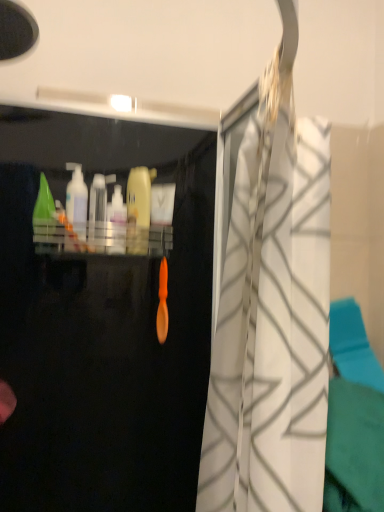
What is the approximate height of translucent plastic bottle at left, positioned as the 3th cleaning product in right-to-left order?

The height of translucent plastic bottle at left, positioned as the 3th cleaning product in right-to-left order, is 8.21 inches.

The width and height of the screenshot is (384, 512). Describe the element at coordinates (97, 213) in the screenshot. I see `transparent plastic bottle at center` at that location.

Where is `white textured curtain at center`? This screenshot has height=512, width=384. white textured curtain at center is located at coordinates (272, 321).

Image resolution: width=384 pixels, height=512 pixels. What do you see at coordinates (118, 218) in the screenshot? I see `translucent plastic bottle at center, the second cleaning product viewed from the right` at bounding box center [118, 218].

You are a GUI agent. You are given a task and a screenshot of the screen. Output one action in this format:
    pyautogui.click(x=<x>, y=<y>)
    Task: Click on the translucent plastic bottle at left, which ranks as the 2th cleaning product in left-to-right order
    
    Given the screenshot: What is the action you would take?
    pyautogui.click(x=77, y=206)

Is yellow matte bottle at center, which is the first cleaning product in right-to-left order, not near translucent plastic bottle at left, which ranks as the 2th cleaning product in left-to-right order?

Actually, yellow matte bottle at center, which is the first cleaning product in right-to-left order, and translucent plastic bottle at left, which ranks as the 2th cleaning product in left-to-right order, are a little close together.

Can you confirm if yellow matte bottle at center, which is the first cleaning product in right-to-left order, is shorter than translucent plastic bottle at left, which ranks as the 2th cleaning product in left-to-right order?

In fact, yellow matte bottle at center, which is the first cleaning product in right-to-left order, may be taller than translucent plastic bottle at left, which ranks as the 2th cleaning product in left-to-right order.

From the yellow matte bottle at center, which is the first cleaning product in right-to-left order, count the 2nd cleaning product to the left and point to it. Please provide its 2D coordinates.

[(77, 206)]

Considering the points (149, 219) and (78, 212), which point is in front, point (149, 219) or point (78, 212)?

The point (78, 212) is more forward.

Is translucent plastic bottle at center, the second cleaning product viewed from the right, at the right side of transparent plastic bottle at center?

Yes.

Which object is closer to the camera, translucent plastic bottle at center, acting as the third cleaning product starting from the left, or transparent plastic bottle at center?

transparent plastic bottle at center.

Is translucent plastic bottle at center, acting as the third cleaning product starting from the left, situated inside transparent plastic bottle at center or outside?

translucent plastic bottle at center, acting as the third cleaning product starting from the left, cannot be found inside transparent plastic bottle at center.

Is translucent plastic bottle at center, acting as the third cleaning product starting from the left, wider than transparent plastic bottle at center?

No, translucent plastic bottle at center, acting as the third cleaning product starting from the left, is not wider than transparent plastic bottle at center.

From the image's perspective, is yellow matte bottle at center, arranged as the 4th cleaning product when viewed from the left, below white textured curtain at center?

No.

Considering the sizes of yellow matte bottle at center, which is the first cleaning product in right-to-left order, and white textured curtain at center in the image, is yellow matte bottle at center, which is the first cleaning product in right-to-left order, wider or thinner than white textured curtain at center?

In the image, yellow matte bottle at center, which is the first cleaning product in right-to-left order, appears to be more narrow than white textured curtain at center.

Considering the positions of objects yellow matte bottle at center, which is the first cleaning product in right-to-left order, and white textured curtain at center in the image provided, who is more to the right, yellow matte bottle at center, which is the first cleaning product in right-to-left order, or white textured curtain at center?

From the viewer's perspective, white textured curtain at center appears more on the right side.

Can you tell me how much yellow matte bottle at center, which is the first cleaning product in right-to-left order, and white textured curtain at center differ in facing direction?

75.4 degrees separate the facing orientations of yellow matte bottle at center, which is the first cleaning product in right-to-left order, and white textured curtain at center.

Is translucent plastic bottle at center, the second cleaning product viewed from the right, to the right of white textured curtain at center from the viewer's perspective?

No.

Which object is wider, translucent plastic bottle at center, acting as the third cleaning product starting from the left, or white textured curtain at center?

With larger width is white textured curtain at center.

Are translucent plastic bottle at center, the second cleaning product viewed from the right, and white textured curtain at center located far from each other?

No, translucent plastic bottle at center, the second cleaning product viewed from the right, is not far from white textured curtain at center.

From their relative heights in the image, would you say translucent plastic bottle at center, acting as the third cleaning product starting from the left, is taller or shorter than white textured curtain at center?

translucent plastic bottle at center, acting as the third cleaning product starting from the left, is shorter than white textured curtain at center.

Is translucent plastic bottle at center, the second cleaning product viewed from the right, facing away from yellow matte bottle at center, which is the first cleaning product in right-to-left order?

No, translucent plastic bottle at center, the second cleaning product viewed from the right, is not facing away from yellow matte bottle at center, which is the first cleaning product in right-to-left order.

Can you confirm if translucent plastic bottle at center, acting as the third cleaning product starting from the left, is positioned to the right of yellow matte bottle at center, which is the first cleaning product in right-to-left order?

No.

Are translucent plastic bottle at center, the second cleaning product viewed from the right, and yellow matte bottle at center, arranged as the 4th cleaning product when viewed from the left, located far from each other?

That's not correct — translucent plastic bottle at center, the second cleaning product viewed from the right, is a little close to yellow matte bottle at center, arranged as the 4th cleaning product when viewed from the left.

How many degrees apart are the facing directions of translucent plastic bottle at center, the second cleaning product viewed from the right, and yellow matte bottle at center, which is the first cleaning product in right-to-left order?

They differ by 0.00444 degrees in their facing directions.

Is green plastic cone at upper left, which is counted as the fourth cleaning product, starting from the right, with white textured curtain at center?

No, green plastic cone at upper left, which is counted as the fourth cleaning product, starting from the right, is not in contact with white textured curtain at center.

Is point (52, 220) positioned behind point (236, 441)?

Yes, it is.

Where is `curtain on the right of green plastic cone at upper left, which is counted as the fourth cleaning product, starting from the right`? The width and height of the screenshot is (384, 512). curtain on the right of green plastic cone at upper left, which is counted as the fourth cleaning product, starting from the right is located at coordinates (272, 321).

Is white textured curtain at center facing towards translucent plastic bottle at left, which ranks as the 2th cleaning product in left-to-right order?

No, white textured curtain at center is not oriented towards translucent plastic bottle at left, which ranks as the 2th cleaning product in left-to-right order.

Is white textured curtain at center not inside translucent plastic bottle at left, positioned as the 3th cleaning product in right-to-left order?

Indeed, white textured curtain at center is completely outside translucent plastic bottle at left, positioned as the 3th cleaning product in right-to-left order.

Based on the photo, considering the relative positions of white textured curtain at center and translucent plastic bottle at left, positioned as the 3th cleaning product in right-to-left order, in the image provided, is white textured curtain at center to the left or to the right of translucent plastic bottle at left, positioned as the 3th cleaning product in right-to-left order,?

white textured curtain at center is to the right of translucent plastic bottle at left, positioned as the 3th cleaning product in right-to-left order.

From the image's perspective, which is above, white textured curtain at center or translucent plastic bottle at left, positioned as the 3th cleaning product in right-to-left order?

translucent plastic bottle at left, positioned as the 3th cleaning product in right-to-left order, from the image's perspective.

Starting from the yellow matte bottle at center, arranged as the 4th cleaning product when viewed from the left, which cleaning product is the 2nd one to the left? Please provide its 2D coordinates.

[(77, 206)]

Where is `bottle in front of the translucent plastic bottle at center, the second cleaning product viewed from the right`? This screenshot has height=512, width=384. bottle in front of the translucent plastic bottle at center, the second cleaning product viewed from the right is located at coordinates (97, 213).

Looking at the image, which one is located further to green plastic cone at upper left, which is counted as the fourth cleaning product, starting from the right, translucent plastic bottle at left, which ranks as the 2th cleaning product in left-to-right order, or white textured curtain at center?

white textured curtain at center is positioned further to the anchor green plastic cone at upper left, which is counted as the fourth cleaning product, starting from the right.

Based on their spatial positions, is green plastic cone at upper left, which is counted as the fourth cleaning product, starting from the right, or white textured curtain at center further from transparent plastic bottle at center?

Based on the image, white textured curtain at center appears to be further to transparent plastic bottle at center.

Estimate the real-world distances between objects in this image. Which object is further from translucent plastic bottle at center, the second cleaning product viewed from the right, transparent plastic bottle at center or green plastic cone at upper left, which is counted as the fourth cleaning product, starting from the right?

Based on the image, green plastic cone at upper left, which is counted as the fourth cleaning product, starting from the right, appears to be further to translucent plastic bottle at center, the second cleaning product viewed from the right.

When comparing their distances from green plastic cone at upper left, which is counted as the fourth cleaning product, starting from the right, does white textured curtain at center or translucent plastic bottle at center, the second cleaning product viewed from the right, seem closer?

translucent plastic bottle at center, the second cleaning product viewed from the right, is positioned closer to the anchor green plastic cone at upper left, which is counted as the fourth cleaning product, starting from the right.

Looking at this image, based on their spatial positions, is yellow matte bottle at center, which is the first cleaning product in right-to-left order, or translucent plastic bottle at left, which ranks as the 2th cleaning product in left-to-right order, closer to white textured curtain at center?

yellow matte bottle at center, which is the first cleaning product in right-to-left order, is positioned closer to the anchor white textured curtain at center.

Which object lies nearer to the anchor point white textured curtain at center, transparent plastic bottle at center or translucent plastic bottle at left, positioned as the 3th cleaning product in right-to-left order?

Among the two, transparent plastic bottle at center is located nearer to white textured curtain at center.

When comparing their distances from transparent plastic bottle at center, does translucent plastic bottle at center, acting as the third cleaning product starting from the left, or white textured curtain at center seem closer?

translucent plastic bottle at center, acting as the third cleaning product starting from the left.

Which object lies nearer to the anchor point transparent plastic bottle at center, translucent plastic bottle at center, the second cleaning product viewed from the right, or translucent plastic bottle at left, which ranks as the 2th cleaning product in left-to-right order?

translucent plastic bottle at left, which ranks as the 2th cleaning product in left-to-right order, is closer to transparent plastic bottle at center.

You are a GUI agent. You are given a task and a screenshot of the screen. Output one action in this format:
    pyautogui.click(x=<x>, y=<y>)
    Task: Click on the bottle located between green plastic cone at upper left, which is counted as the fourth cleaning product, starting from the right, and yellow matte bottle at center, arranged as the 4th cleaning product when viewed from the left, in the left-right direction
    Image resolution: width=384 pixels, height=512 pixels.
    Given the screenshot: What is the action you would take?
    pyautogui.click(x=97, y=213)

You are a GUI agent. You are given a task and a screenshot of the screen. Output one action in this format:
    pyautogui.click(x=<x>, y=<y>)
    Task: Click on the bottle positioned between white textured curtain at center and translucent plastic bottle at center, acting as the third cleaning product starting from the left, from near to far
    Image resolution: width=384 pixels, height=512 pixels.
    Given the screenshot: What is the action you would take?
    pyautogui.click(x=97, y=213)

This screenshot has width=384, height=512. Identify the location of cleaning product between green plastic cone at upper left, which is counted as the fourth cleaning product, starting from the right, and transparent plastic bottle at center from left to right. (77, 206).

This screenshot has width=384, height=512. In order to click on cleaning product situated between green plastic cone at upper left, which ranks as the first cleaning product in left-to-right order, and translucent plastic bottle at center, acting as the third cleaning product starting from the left, from left to right in this screenshot , I will do `click(77, 206)`.